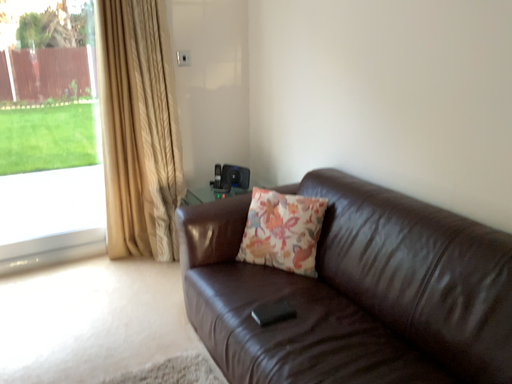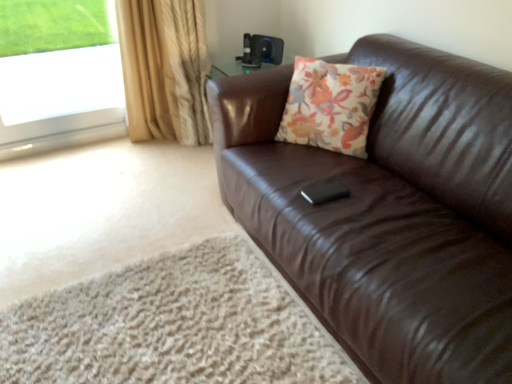
Question: Which way did the camera rotate in the video?

Choices:
 (A) rotated upward
 (B) rotated downward

Answer: (B)